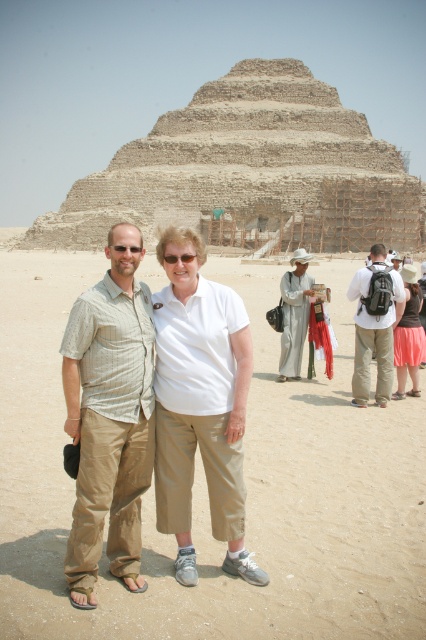
Does beige cotton pants at center have a larger size compared to white cotton dress at center?

No, beige cotton pants at center is not bigger than white cotton dress at center.

Who is positioned more to the right, beige cotton pants at center or white cotton dress at center?

From the viewer's perspective, white cotton dress at center appears more on the right side.

Is point (72, 433) closer to viewer compared to point (305, 285)?

Yes, it is.

This screenshot has height=640, width=426. Identify the location of beige cotton pants at center. (109, 417).

Between beige stone pyramid at center and matte black backpack at center, which one appears on the left side from the viewer's perspective?

beige stone pyramid at center

Is point (308, 163) positioned after point (367, 316)?

Yes, it is.

Is point (176, 221) more distant than point (380, 253)?

Yes, it is.

Locate an element on the screen. The image size is (426, 640). beige stone pyramid at center is located at coordinates (250, 172).

Based on the photo, is beige stone pyramid at center smaller than white cotton dress at center?

Actually, beige stone pyramid at center might be larger than white cotton dress at center.

Is point (391, 177) more distant than point (296, 300)?

That is True.

Is point (325, 92) farther from viewer compared to point (301, 308)?

That is True.

Locate an element on the screen. The image size is (426, 640). beige stone pyramid at center is located at coordinates (250, 172).